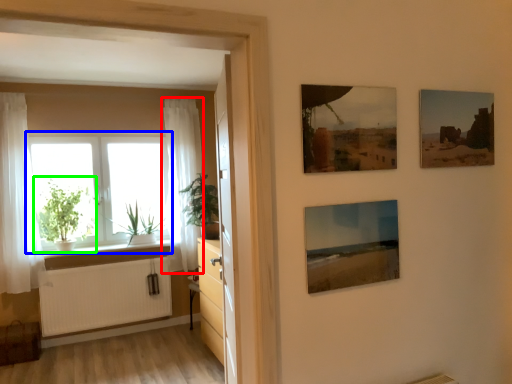
Question: Which object is positioned closest to curtain (highlighted by a red box)? Select from window (highlighted by a blue box) and houseplant (highlighted by a green box).

Choices:
 (A) window
 (B) houseplant

Answer: (A)